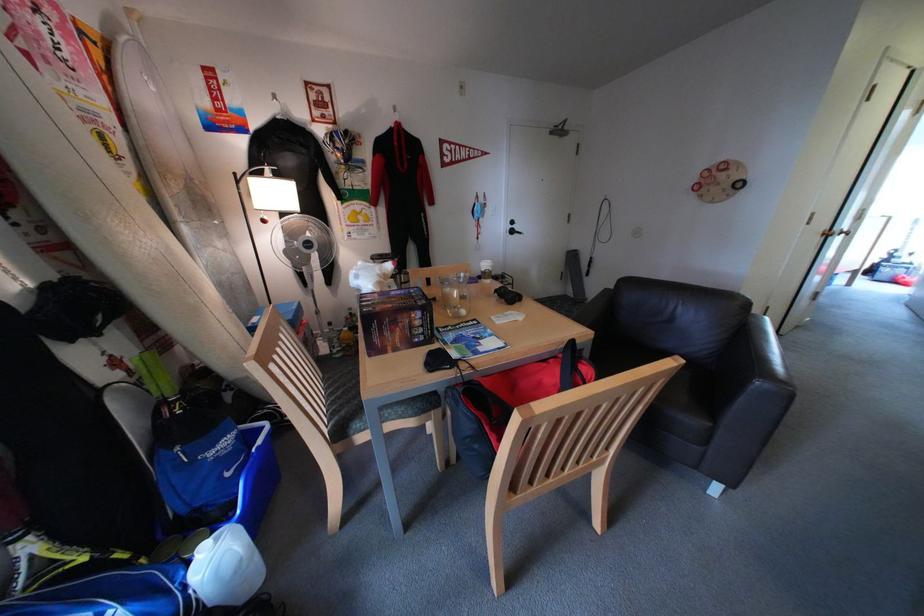
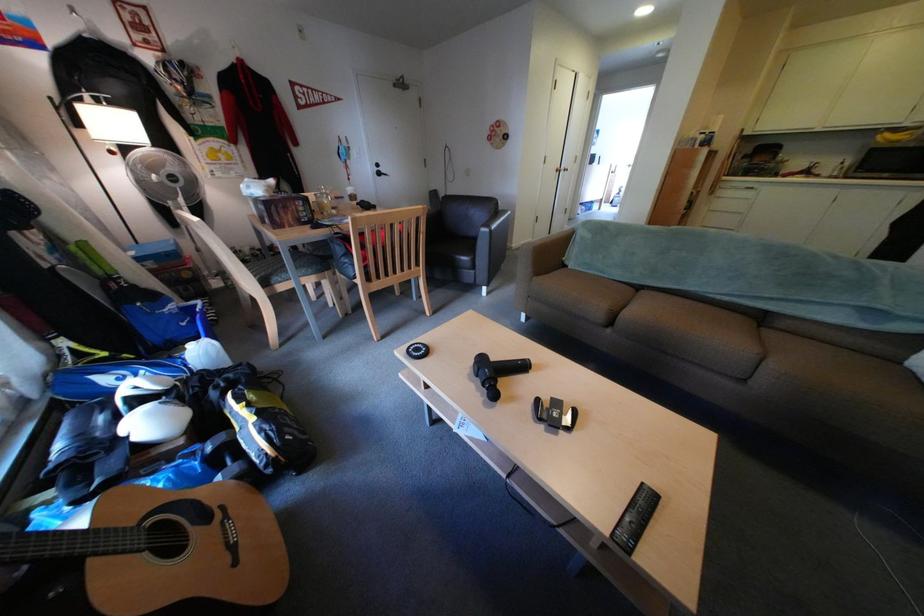
The point at (516, 230) is marked in the first image. Where is the corresponding point in the second image?

(383, 172)